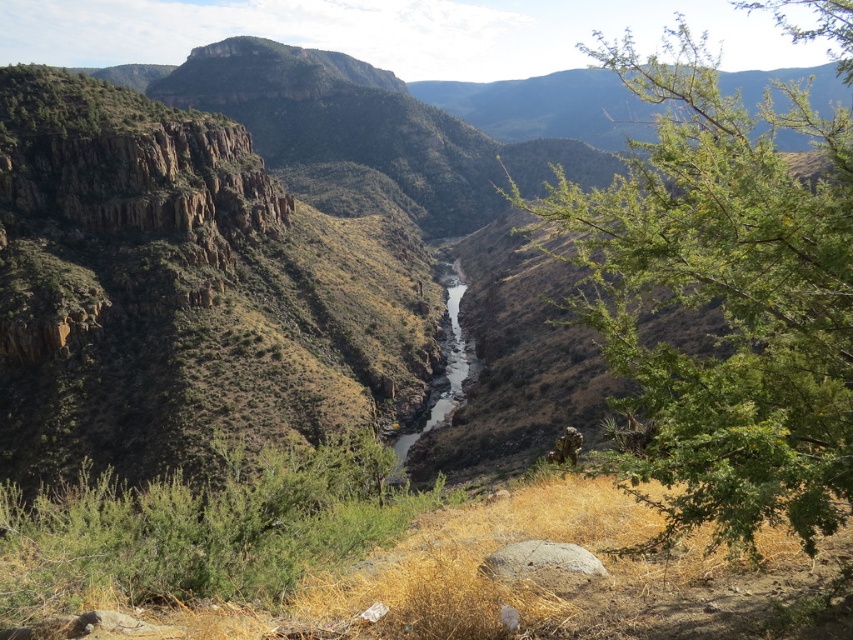
You are a hiker trying to navigate through the canyon. You need to cross the white sandy stream at center but want to avoid the green leafy tree at lower right. Which direction should you head to move away from the tree while approaching the stream?

To move away from the green leafy tree at lower right while approaching the white sandy stream at center, you should head towards the center from the opposite direction of the tree. Since the tree is at the lower right, moving towards the center from the left or upper areas would keep you away from the tree while reaching the stream.

From the picture: You are a hiker trying to cross the white sandy stream at center. There is a green leafy tree at lower right nearby. Can you use the tree to help you cross the stream safely?

The green leafy tree at lower right is positioned over the white sandy stream at center, so you can use its branches or roots to stabilize yourself while crossing the stream safely.